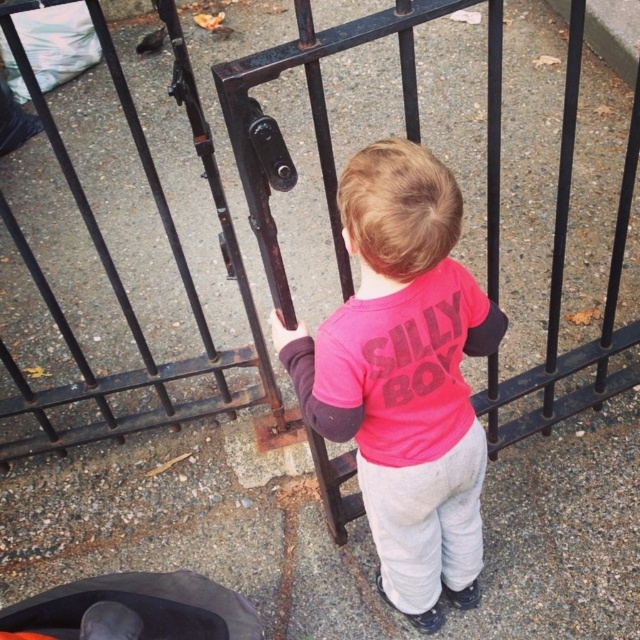
Can you confirm if pink matte shirt at center is bigger than black fabric baby carriage at lower left?

Yes, pink matte shirt at center is bigger than black fabric baby carriage at lower left.

Is point (483, 436) positioned after point (97, 604)?

That is True.

Which is behind, point (330, 349) or point (236, 628)?

The point (236, 628) is more distant.

Identify the location of pink matte shirt at center. (404, 376).

Is black metal gate at center positioned at the back of black fabric baby carriage at lower left?

No, it is in front of black fabric baby carriage at lower left.

Which of these two, black metal gate at center or black fabric baby carriage at lower left, stands taller?

With more height is black metal gate at center.

Who is more forward, [564,404] or [177,586]?

Point [177,586] is more forward.

Identify the location of black metal gate at center. (120, 280).

Which is more to the left, black metal gate at center or pink matte shirt at center?

black metal gate at center is more to the left.

Who is higher up, black metal gate at center or pink matte shirt at center?

Positioned higher is black metal gate at center.

At what (x,y) coordinates should I click in order to perform the action: click on black metal gate at center. Please return your answer as a coordinate pair (x, y). This screenshot has width=640, height=640. Looking at the image, I should click on (120, 280).

Find the location of a particular element. black metal gate at center is located at coordinates (120, 280).